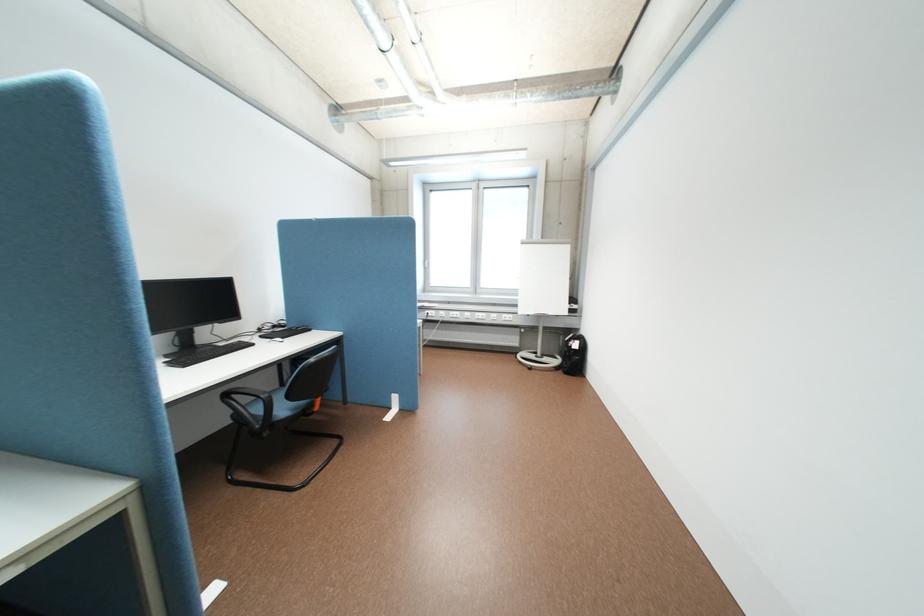
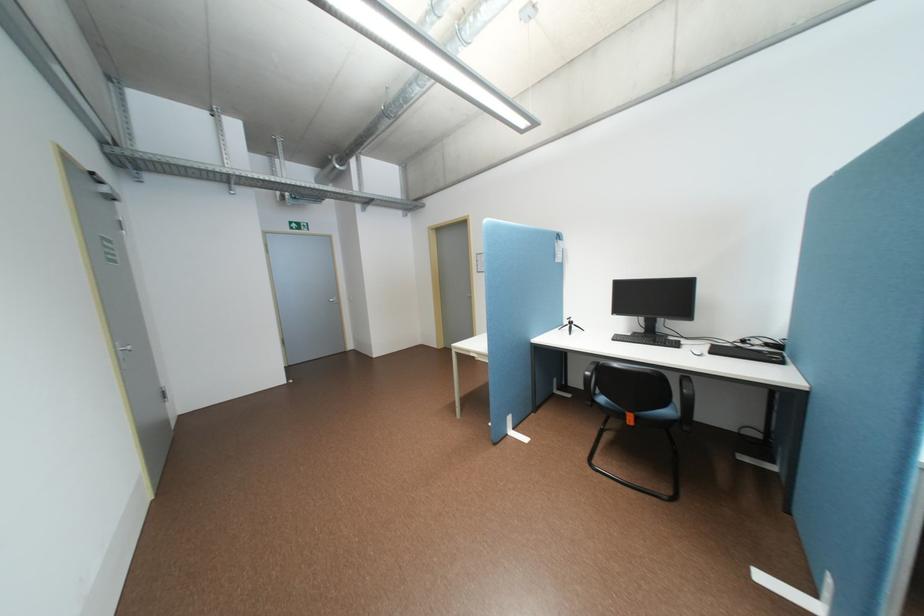
Where in the second image is the point corresponding to pixel 263 344 from the first image?

(688, 346)